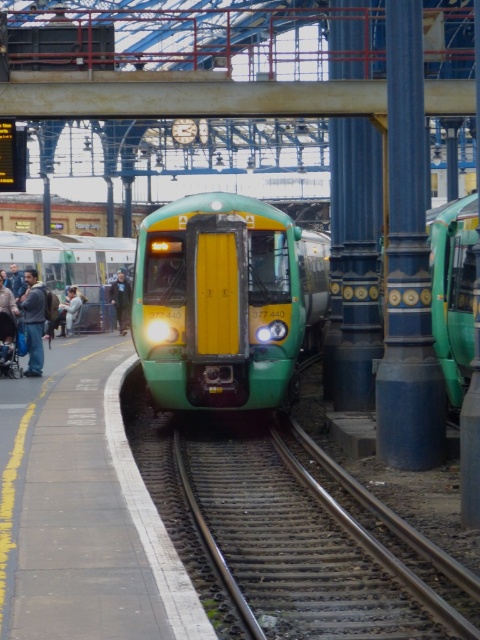
Is green matte train at right thinner than dark blue jeans at lower left?

No, green matte train at right is not thinner than dark blue jeans at lower left.

Does green matte train at right appear on the right side of dark blue jeans at lower left?

Yes, green matte train at right is to the right of dark blue jeans at lower left.

Is point (432, 333) farther from viewer compared to point (1, 276)?

No.

What are the coordinates of `green matte train at right` in the screenshot? It's located at (453, 289).

Is blue polished metal pillar at center-right to the left of green matte train at right from the viewer's perspective?

Correct, you'll find blue polished metal pillar at center-right to the left of green matte train at right.

Does point (403, 461) lie in front of point (434, 212)?

That is True.

You are a GUI agent. You are given a task and a screenshot of the screen. Output one action in this format:
    pyautogui.click(x=<x>, y=<y>)
    Task: Click on the blue polished metal pillar at center-right
    The image size is (480, 640).
    Given the screenshot: What is the action you would take?
    pyautogui.click(x=408, y=266)

Can you confirm if blue polished metal pillar at center-right is taller than dark blue jeans at lower left?

Yes.

Who is taller, blue polished metal pillar at center-right or dark blue jeans at lower left?

With more height is blue polished metal pillar at center-right.

At what (x,y) coordinates should I click in order to perform the action: click on blue polished metal pillar at center-right. Please return your answer as a coordinate pair (x, y). Looking at the image, I should click on (408, 266).

You are a GUI agent. You are given a task and a screenshot of the screen. Output one action in this format:
    pyautogui.click(x=<x>, y=<y>)
    Task: Click on the blue polished metal pillar at center-right
    
    Given the screenshot: What is the action you would take?
    pyautogui.click(x=408, y=266)